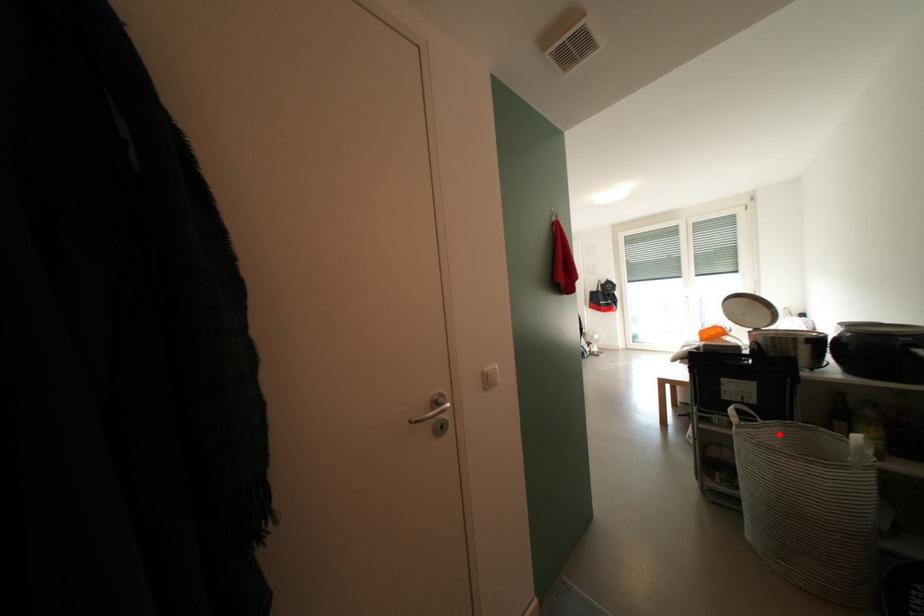
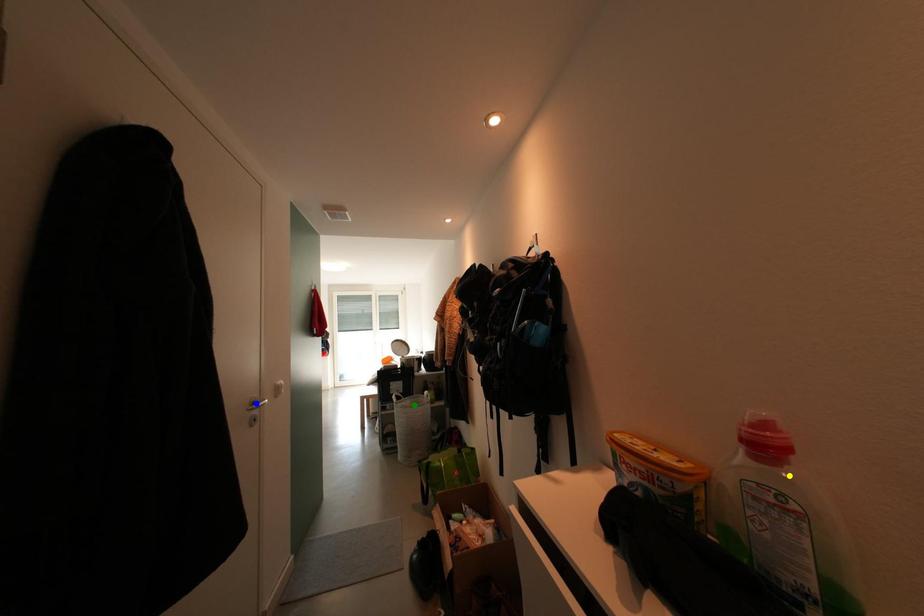
Question: I am providing you with two images of the same scene from different viewpoints. A red point is marked on the first image. You are given multiple points on the second image. Which point in image 2 is actually the same real-world point as the red point in image 1?

Choices:
 (A) green point
 (B) yellow point
 (C) blue point

Answer: (A)